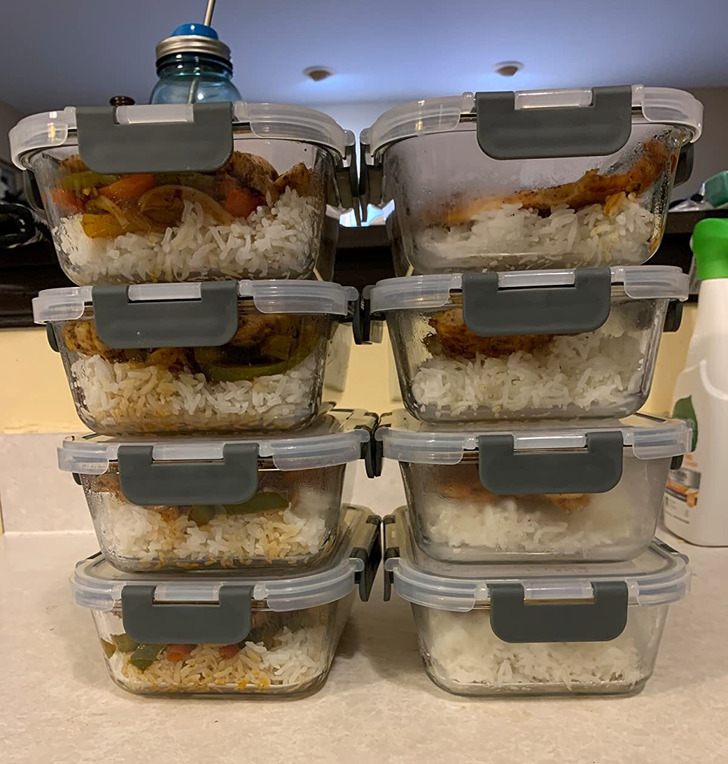
Locate an element on the screen. clear square food storage containers is located at coordinates (183, 219), (512, 201), (186, 387), (523, 383), (210, 523), (561, 520), (205, 662), (536, 659).